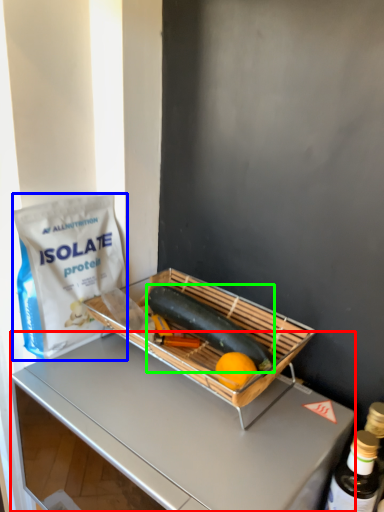
Question: Estimate the real-world distances between objects in this image. Which object is closer to desk (highlighted by a red box), grocery bag (highlighted by a blue box) or green vegetables (highlighted by a green box)?

Choices:
 (A) grocery bag
 (B) green vegetables

Answer: (A)